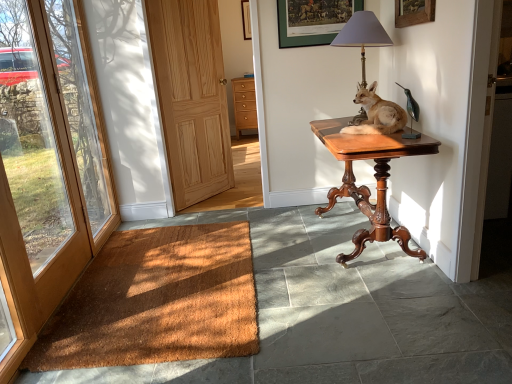
Locate an element on the screen. The image size is (512, 384). empty space that is ontop of brown coir doormat at lower left is located at coordinates (169, 272).